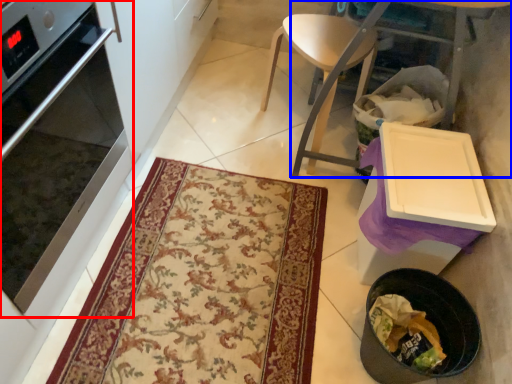
Question: Which object is closer to the camera taking this photo, oven (highlighted by a red box) or table (highlighted by a blue box)?

Choices:
 (A) oven
 (B) table

Answer: (A)